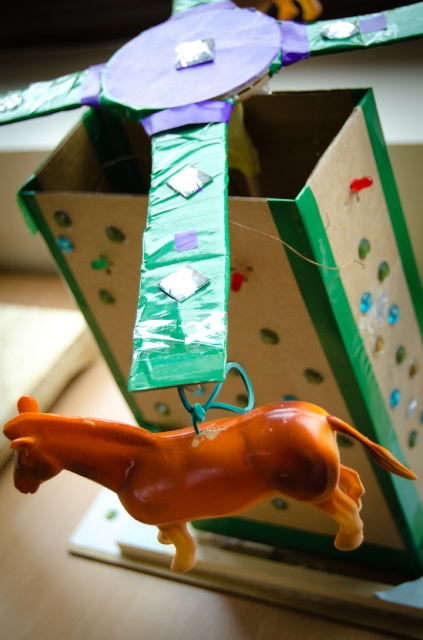
Question: In this image, where is green cardboard box at center located relative to orange glossy horse at lower center?

Choices:
 (A) above
 (B) below

Answer: (A)

Question: Is green cardboard box at center below orange glossy horse at lower center?

Choices:
 (A) no
 (B) yes

Answer: (A)

Question: Does green cardboard box at center appear under orange glossy horse at lower center?

Choices:
 (A) yes
 (B) no

Answer: (B)

Question: Which point is farther to the camera?

Choices:
 (A) (285, 484)
 (B) (46, 186)

Answer: (B)

Question: Which point appears farthest from the camera in this image?

Choices:
 (A) [x=222, y=465]
 (B) [x=104, y=220]

Answer: (B)

Question: Which of the following is the farthest from the observer?

Choices:
 (A) green cardboard box at center
 (B) orange glossy horse at lower center

Answer: (A)